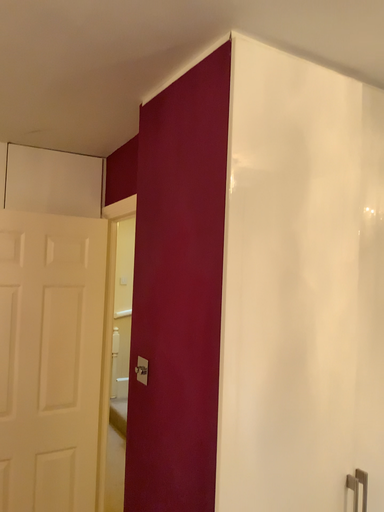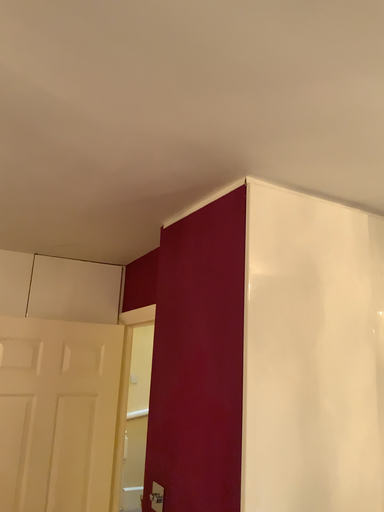
Question: Which way did the camera rotate in the video?

Choices:
 (A) rotated upward
 (B) rotated downward

Answer: (A)